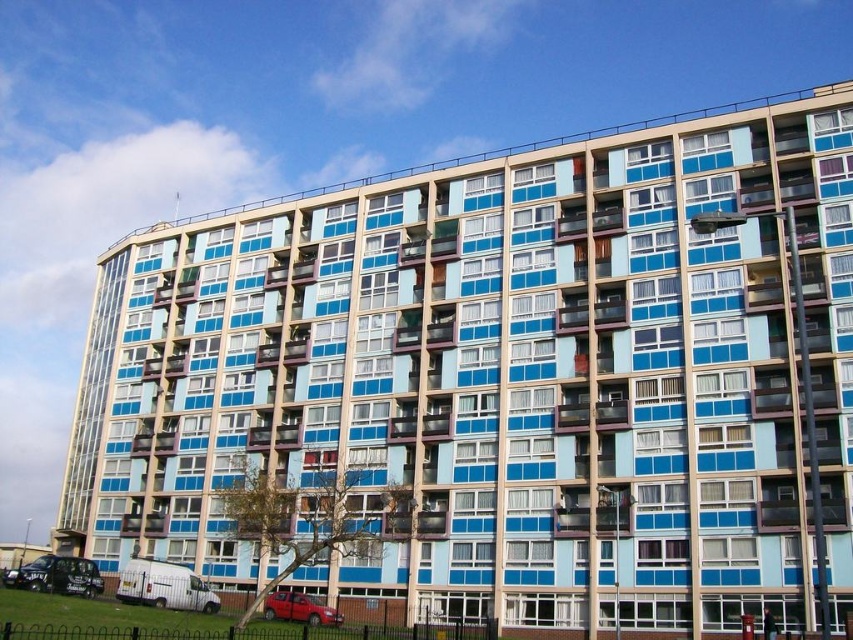
Question: Which point is closer to the camera taking this photo?

Choices:
 (A) (285, 611)
 (B) (71, 566)

Answer: (A)

Question: Which point is closer to the camera?

Choices:
 (A) (312, 616)
 (B) (53, 572)

Answer: (A)

Question: In this image, where is black matte taxi at lower left located relative to metallic red car at lower center?

Choices:
 (A) above
 (B) below

Answer: (B)

Question: Does black matte taxi at lower left lie in front of metallic red car at lower center?

Choices:
 (A) no
 (B) yes

Answer: (A)

Question: Is black matte taxi at lower left to the left of metallic red car at lower center from the viewer's perspective?

Choices:
 (A) no
 (B) yes

Answer: (B)